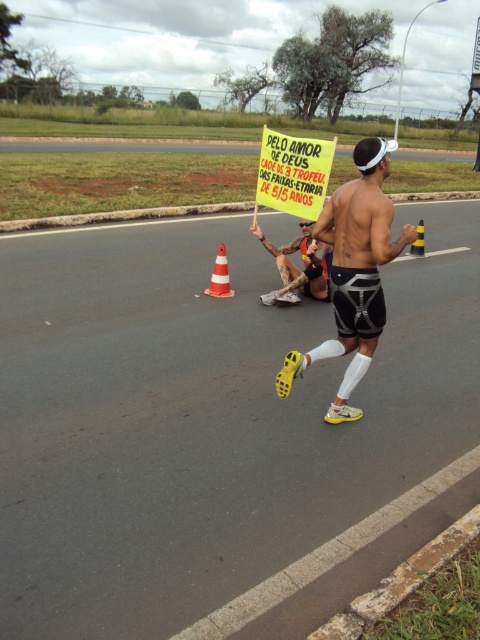
Question: Is yellow paper sign at center thinner than yellow/black striped cone at center-right?

Choices:
 (A) no
 (B) yes

Answer: (A)

Question: Can you confirm if orange striped traffic cone at center is smaller than yellow/black striped cone at center-right?

Choices:
 (A) no
 (B) yes

Answer: (B)

Question: Which of these objects is positioned closest to the matte yellow sign at right?

Choices:
 (A) yellow paper sign at center
 (B) black matte shorts at center
 (C) yellow/black striped cone at center-right
 (D) orange striped traffic cone at center

Answer: (B)

Question: Considering the real-world distances, which object is closest to the yellow paper sign at center?

Choices:
 (A) orange striped traffic cone at center
 (B) black matte shorts at center
 (C) matte yellow sign at right
 (D) yellow/black striped cone at center-right

Answer: (B)

Question: Can you confirm if yellow paper sign at center is positioned to the left of black matte shorts at center?

Choices:
 (A) no
 (B) yes

Answer: (B)

Question: Which point appears farthest from the camera in this image?

Choices:
 (A) (264, 304)
 (B) (304, 202)
 (C) (416, 244)
 (D) (223, 262)

Answer: (C)